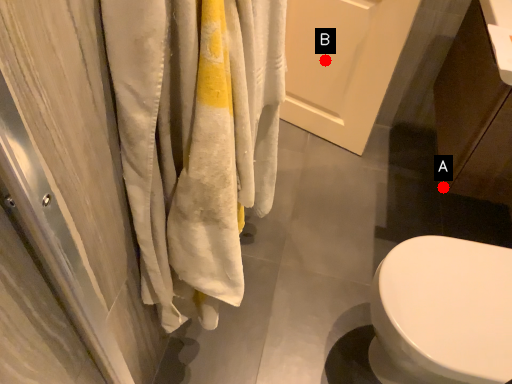
Question: Two points are circled on the image, labeled by A and B beside each circle. Which point appears farthest from the camera in this image?

Choices:
 (A) A is further
 (B) B is further

Answer: (B)